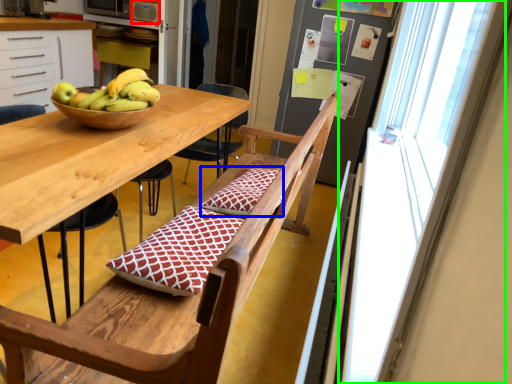
Question: Estimate the real-world distances between objects in this image. Which object is farther from appliance (highlighted by a red box), pillow (highlighted by a blue box) or window screen (highlighted by a green box)?

Choices:
 (A) pillow
 (B) window screen

Answer: (B)